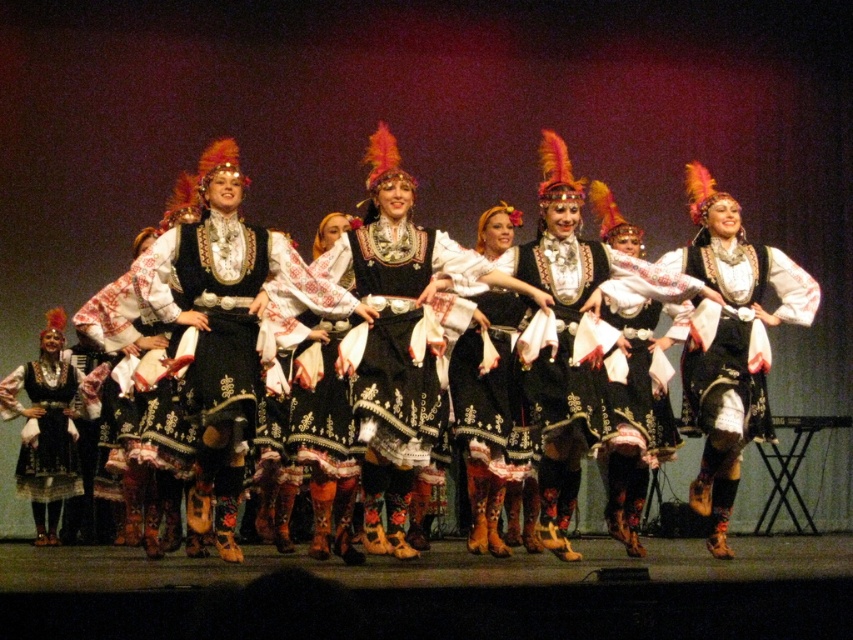
Question: Can you confirm if embroidered velvet dress at center is positioned to the right of black satin dress at center?

Choices:
 (A) no
 (B) yes

Answer: (B)

Question: Can you confirm if black embroidered dress at center is thinner than matte black dress at left?

Choices:
 (A) yes
 (B) no

Answer: (B)

Question: Which is farther from the embroidered velvet dress at center?

Choices:
 (A) matte black dress at left
 (B) black satin dress at center

Answer: (A)

Question: Which object appears farthest from the camera in this image?

Choices:
 (A) black embroidered dress at center
 (B) black satin dress at center

Answer: (B)

Question: Which object appears farthest from the camera in this image?

Choices:
 (A) matte black dress at left
 (B) embroidered velvet dress at center
 (C) black embroidered dress at center
 (D) black satin dress at center

Answer: (A)

Question: Does black embroidered dress at center appear under black satin dress at center?

Choices:
 (A) no
 (B) yes

Answer: (B)